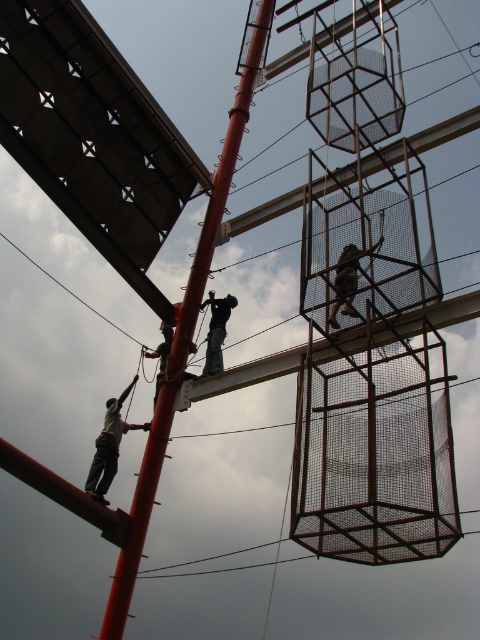
You are a safety inspector evaluating the equipment in the image. You see a yellow safety harness at center and dark blue jeans at center. Which item appears bigger in the image?

The yellow safety harness at center is larger in size than dark blue jeans at center, so the yellow safety harness at center appears bigger in the image.